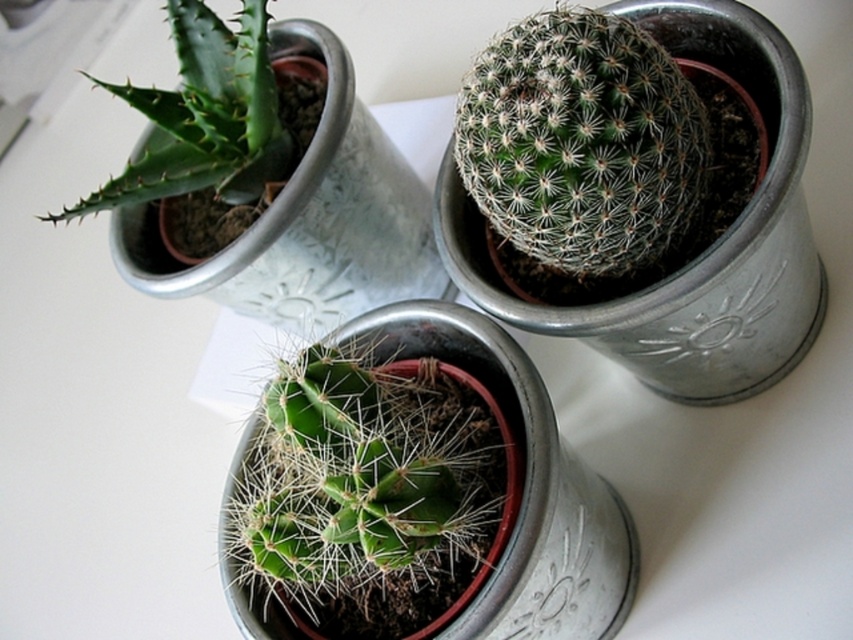
Which is behind, point (416, 572) or point (215, 70)?

Positioned behind is point (215, 70).

Is green spiny cactus at center positioned at the back of green spiky plant at upper left?

No.

Is point (480, 410) positioned after point (254, 132)?

No, it is not.

You are a GUI agent. You are given a task and a screenshot of the screen. Output one action in this format:
    pyautogui.click(x=<x>, y=<y>)
    Task: Click on the green spiny cactus at center
    Image resolution: width=853 pixels, height=640 pixels.
    Given the screenshot: What is the action you would take?
    pyautogui.click(x=370, y=493)

Is point (300, 388) positioned behind point (711, 154)?

No.

Does green spiny cactus at center have a lesser height compared to green spiny cactus at upper right?

Incorrect, green spiny cactus at center's height does not fall short of green spiny cactus at upper right's.

Which is behind, point (514, 461) or point (601, 29)?

The point (514, 461) is more distant.

Locate an element on the screen. The image size is (853, 640). green spiny cactus at center is located at coordinates (370, 493).

In the scene shown: Does green spiny cactus at upper right appear on the right side of green spiky plant at upper left?

Correct, you'll find green spiny cactus at upper right to the right of green spiky plant at upper left.

From the picture: Is green spiny cactus at upper right behind green spiky plant at upper left?

No.

What do you see at coordinates (582, 141) in the screenshot? The image size is (853, 640). I see `green spiny cactus at upper right` at bounding box center [582, 141].

Identify the location of green spiny cactus at upper right. This screenshot has width=853, height=640. (582, 141).